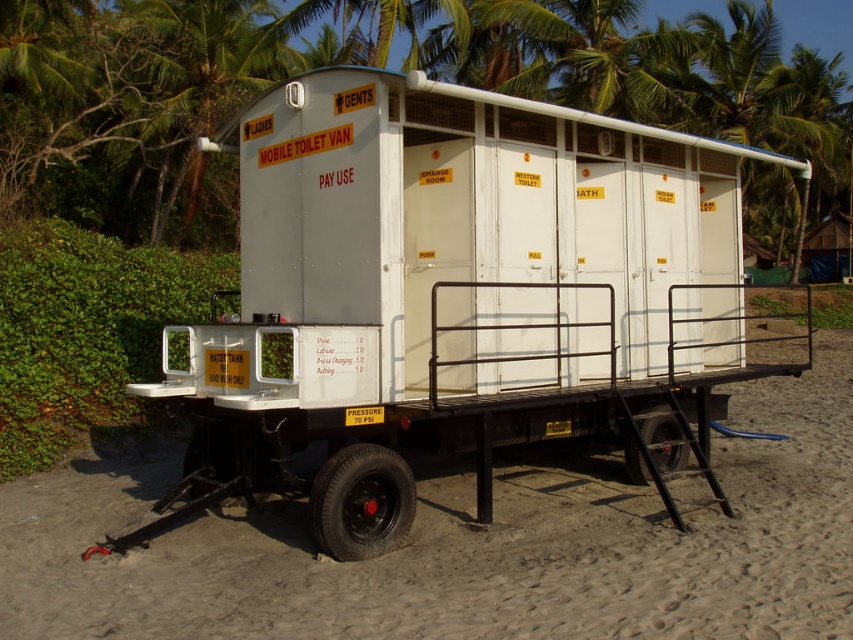
Between white matte mobile toilet van at center and white sand at lower center, which one is positioned lower?

white sand at lower center

Who is positioned more to the right, white matte mobile toilet van at center or white sand at lower center?

From the viewer's perspective, white sand at lower center appears more on the right side.

Is point (387, 243) closer to viewer compared to point (526, 506)?

Yes, point (387, 243) is closer to viewer.

Find the location of a particular element. This screenshot has width=853, height=640. white matte mobile toilet van at center is located at coordinates (456, 296).